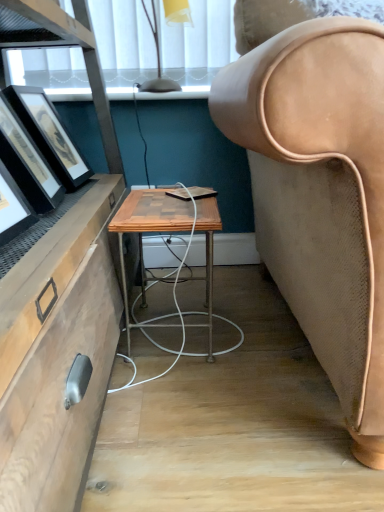
Question: From a real-world perspective, is wooden/matte desk at center physically located above or below translucent yellow glass lampshade at upper center?

Choices:
 (A) above
 (B) below

Answer: (B)

Question: Which is correct: wooden/matte desk at center is inside translucent yellow glass lampshade at upper center, or outside of it?

Choices:
 (A) inside
 (B) outside

Answer: (B)

Question: Which object is the farthest from the wooden/matte desk at center?

Choices:
 (A) matte black picture frame at left
 (B) translucent yellow glass lampshade at upper center

Answer: (B)

Question: Which of these objects is positioned farthest from the wooden/matte desk at center?

Choices:
 (A) matte black picture frame at left
 (B) translucent yellow glass lampshade at upper center

Answer: (B)